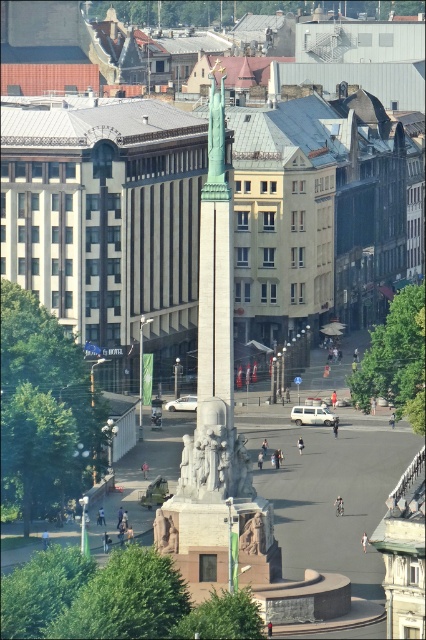
Between polished stone obelisk at center and rustic stone statue at center, which one has less height?

rustic stone statue at center is shorter.

Which is more to the right, polished stone obelisk at center or rustic stone statue at center?

Positioned to the right is rustic stone statue at center.

Measure the distance between point (224, 280) and camera.

402.01 feet

The height and width of the screenshot is (640, 426). In order to click on polished stone obelisk at center in this screenshot , I will do `click(215, 406)`.